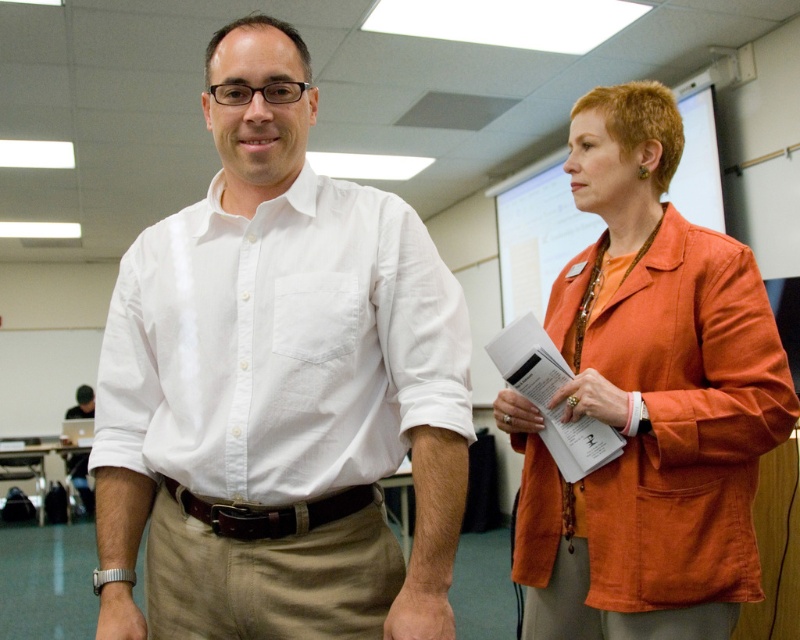
Question: Observing the image, what is the correct spatial positioning of white cotton shirt at center in reference to orange fabric jacket at upper right?

Choices:
 (A) below
 (B) above

Answer: (B)

Question: Which point appears closest to the camera in this image?

Choices:
 (A) (218, 424)
 (B) (328, 497)

Answer: (A)

Question: From the image, what is the correct spatial relationship of white cotton shirt at center in relation to orange fabric bulletin board at upper right?

Choices:
 (A) left
 (B) right

Answer: (A)

Question: Among these points, which one is nearest to the camera?

Choices:
 (A) (584, 148)
 (B) (192, 500)

Answer: (B)

Question: Which point is farther from the camera taking this photo?

Choices:
 (A) (608, 152)
 (B) (302, 512)

Answer: (A)

Question: Is orange fabric jacket at upper right behind brown leather belt at center?

Choices:
 (A) no
 (B) yes

Answer: (B)